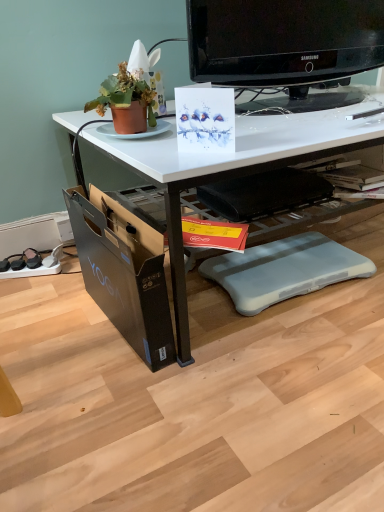
Question: Should I look upward or downward to see black plastic swivel chair at center, the 2th swivel chair when ordered from bottom to top?

Choices:
 (A) down
 (B) up

Answer: (B)

Question: From the image's perspective, is white glossy desk at center above black glossy television at upper center?

Choices:
 (A) no
 (B) yes

Answer: (A)

Question: Is white glossy desk at center bigger than black glossy television at upper center?

Choices:
 (A) yes
 (B) no

Answer: (A)

Question: From the image's perspective, is white glossy desk at center beneath black glossy television at upper center?

Choices:
 (A) yes
 (B) no

Answer: (A)

Question: Is white glossy desk at center at the left side of black glossy television at upper center?

Choices:
 (A) yes
 (B) no

Answer: (A)

Question: Could black glossy television at upper center be considered to be inside white glossy desk at center?

Choices:
 (A) yes
 (B) no

Answer: (B)

Question: From a real-world perspective, is white glossy desk at center positioned under black glossy television at upper center based on gravity?

Choices:
 (A) yes
 (B) no

Answer: (A)

Question: Are yellow paper magazine at center and white glossy desk at center located far from each other?

Choices:
 (A) no
 (B) yes

Answer: (A)

Question: Does yellow paper magazine at center appear on the right side of white glossy desk at center?

Choices:
 (A) yes
 (B) no

Answer: (B)

Question: Is yellow paper magazine at center turned away from white glossy desk at center?

Choices:
 (A) yes
 (B) no

Answer: (A)

Question: Does yellow paper magazine at center appear on the left side of white glossy desk at center?

Choices:
 (A) yes
 (B) no

Answer: (A)

Question: From a real-world perspective, is yellow paper magazine at center under white glossy desk at center?

Choices:
 (A) yes
 (B) no

Answer: (A)

Question: Considering the relative sizes of yellow paper magazine at center and white glossy desk at center in the image provided, is yellow paper magazine at center shorter than white glossy desk at center?

Choices:
 (A) no
 (B) yes

Answer: (B)

Question: Are yellow paper magazine at center and black cardboard file cabinet at lower left beside each other?

Choices:
 (A) yes
 (B) no

Answer: (B)